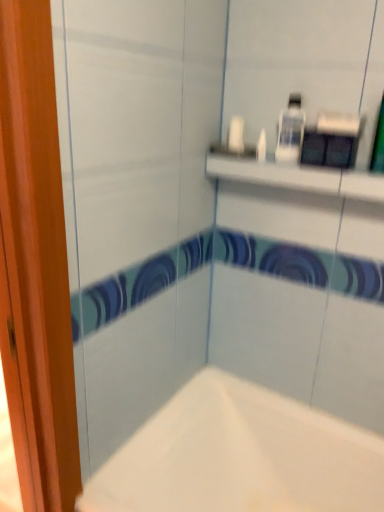
Question: Is white matte bathtub at lower center positioned beyond the bounds of white glossy bottle at upper center?

Choices:
 (A) no
 (B) yes

Answer: (B)

Question: Considering the relative positions of white matte bathtub at lower center and white glossy bottle at upper center in the image provided, is white matte bathtub at lower center in front of white glossy bottle at upper center?

Choices:
 (A) no
 (B) yes

Answer: (B)

Question: From the image's perspective, is white matte bathtub at lower center above white glossy bottle at upper center?

Choices:
 (A) yes
 (B) no

Answer: (B)

Question: Is white matte bathtub at lower center positioned behind white glossy bottle at upper center?

Choices:
 (A) no
 (B) yes

Answer: (A)

Question: Is white matte bathtub at lower center taller than white glossy bottle at upper center?

Choices:
 (A) yes
 (B) no

Answer: (A)

Question: Is white glossy bottle at upper center at the back of white matte bathtub at lower center?

Choices:
 (A) yes
 (B) no

Answer: (B)

Question: Is white glossy bottle at upper center facing towards white matte bathtub at lower center?

Choices:
 (A) yes
 (B) no

Answer: (B)

Question: From the image's perspective, would you say white glossy bottle at upper center is shown under white matte bathtub at lower center?

Choices:
 (A) no
 (B) yes

Answer: (A)

Question: Can you confirm if white glossy bottle at upper center is smaller than white matte bathtub at lower center?

Choices:
 (A) no
 (B) yes

Answer: (B)

Question: Is white glossy bottle at upper center positioned in front of white matte bathtub at lower center?

Choices:
 (A) yes
 (B) no

Answer: (B)

Question: Is white glossy bottle at upper center to the right of white matte bathtub at lower center from the viewer's perspective?

Choices:
 (A) yes
 (B) no

Answer: (A)

Question: Is white glossy bottle at upper center thinner than white matte bathtub at lower center?

Choices:
 (A) yes
 (B) no

Answer: (A)

Question: From their relative heights in the image, would you say white matte bathtub at lower center is taller or shorter than white glossy bottle at upper center?

Choices:
 (A) tall
 (B) short

Answer: (A)